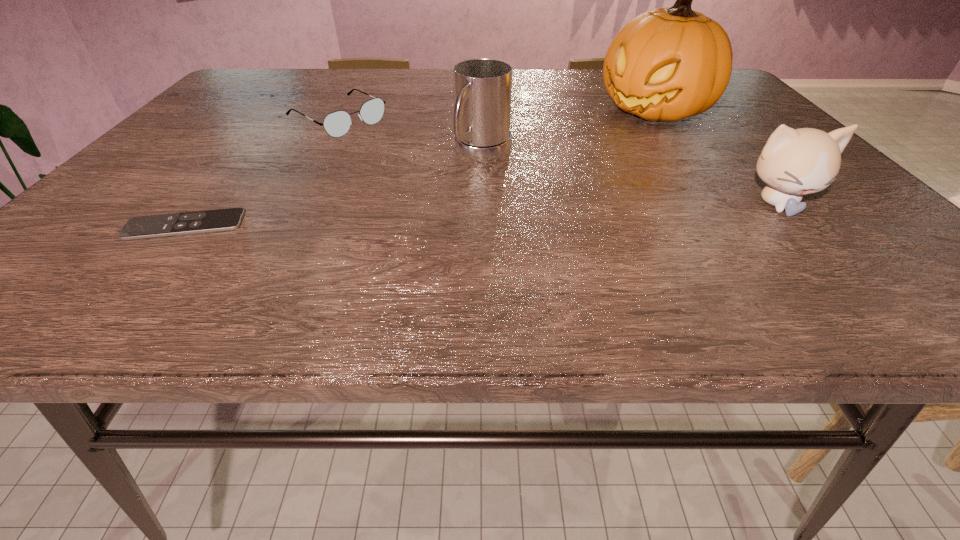
Identify the location of free space located 0.130m on the side of the mug with the handle. (438, 202).

Where is `free space located on the side of the mug with the handle`? The height and width of the screenshot is (540, 960). free space located on the side of the mug with the handle is located at coordinates (393, 246).

Locate an element on the screen. The image size is (960, 540). vacant region located on the side of the mug with the handle is located at coordinates (412, 227).

You are a GUI agent. You are given a task and a screenshot of the screen. Output one action in this format:
    pyautogui.click(x=<x>, y=<y>)
    Task: Click on the free space located 0.400m on the lenses of the second shortest object
    The image size is (960, 540).
    Given the screenshot: What is the action you would take?
    pyautogui.click(x=489, y=199)

You are a GUI agent. You are given a task and a screenshot of the screen. Output one action in this format:
    pyautogui.click(x=<x>, y=<y>)
    Task: Click on the blank area located on the lenses of the second shortest object
    The height and width of the screenshot is (540, 960).
    Given the screenshot: What is the action you would take?
    470,189

This screenshot has width=960, height=540. I want to click on vacant region located on the lenses of the second shortest object, so click(424, 165).

Find the location of `object that is at the far edge`. object that is at the far edge is located at coordinates (667, 64).

Where is `object that is at the near edge`? The height and width of the screenshot is (540, 960). object that is at the near edge is located at coordinates (162, 225).

Where is `object that is at the left edge`? This screenshot has height=540, width=960. object that is at the left edge is located at coordinates (162, 225).

What are the coordinates of `kitten positioned at the right edge` in the screenshot? It's located at click(794, 162).